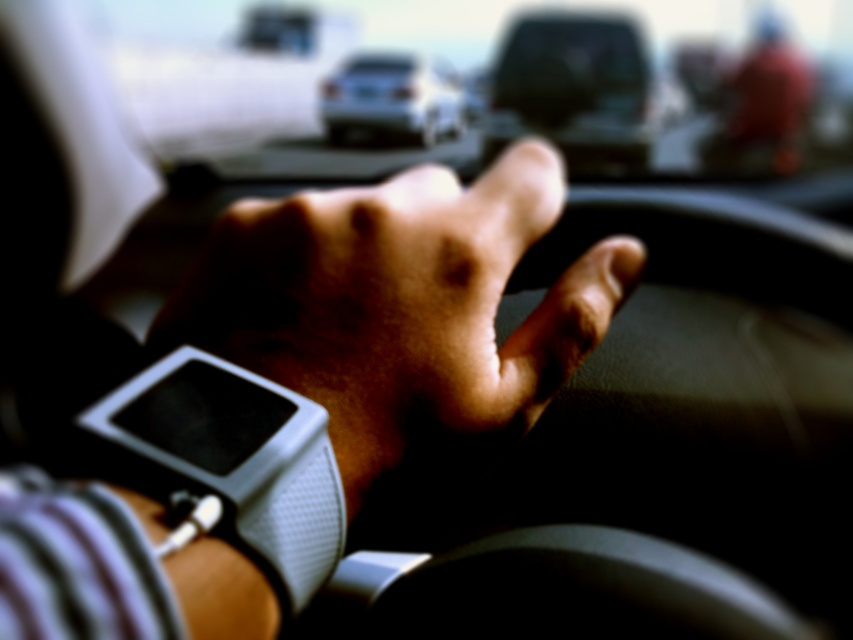
Based on the photo, you are designing a car interior and need to ensure the driver can easily see their watch while driving. Given the position of the white matte watch at center, is it placed in a location that allows for clear visibility without the driver having to move their head?

The white matte watch at center is located at point (402, 310), which is centrally positioned in the driver view, so it is placed in a location that allows for clear visibility without the driver having to move their head.

You are a passenger in the car and you see two points marked on the steering wheel. The first point is at coordinate point (421, 467) and the second point is at coordinate point (397, 74). Which point is closer to you?

Point (421, 467) is in front of point (397, 74), so it is closer to you.